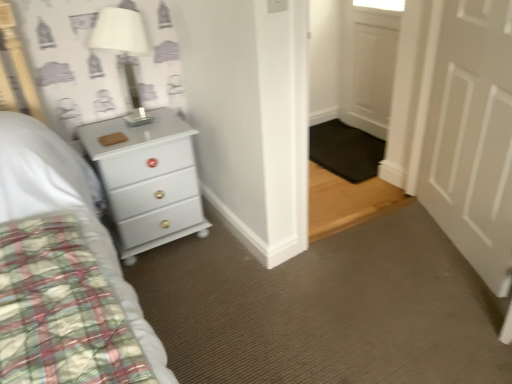
What are the coordinates of `free area below white matte lampshade at upper left (from a real-world perspective)` in the screenshot? It's located at (145, 119).